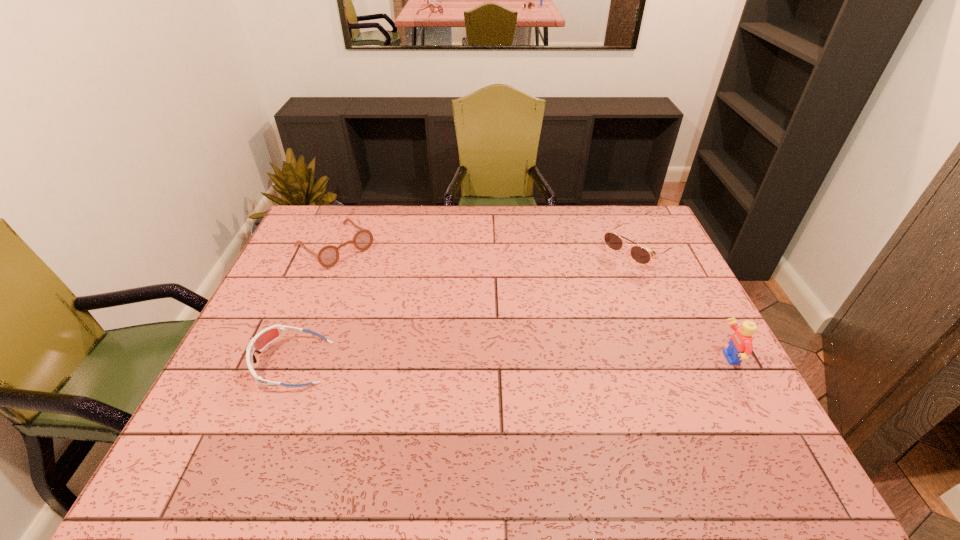
At what (x,y) coordinates should I click in order to perform the action: click on vacant area that lies between the second tallest object and the tallest object. Please return your answer as a coordinate pair (x, y). The height and width of the screenshot is (540, 960). Looking at the image, I should click on (682, 306).

You are a GUI agent. You are given a task and a screenshot of the screen. Output one action in this format:
    pyautogui.click(x=<x>, y=<y>)
    Task: Click on the unoccupied position between the tallest object and the spectacles
    This screenshot has width=960, height=540.
    Given the screenshot: What is the action you would take?
    pyautogui.click(x=531, y=302)

What are the coordinates of `free space that is in between the goggles and the tallest object` in the screenshot? It's located at (510, 361).

Identify the location of vacant point located between the spectacles and the Lego. This screenshot has height=540, width=960. (531, 302).

Find the location of a particular element. This screenshot has height=540, width=960. free space that is in between the spectacles and the tallest object is located at coordinates (531, 302).

Find the location of `vacant area that lies between the spectacles and the goggles`. vacant area that lies between the spectacles and the goggles is located at coordinates (313, 305).

You are a GUI agent. You are given a task and a screenshot of the screen. Output one action in this format:
    pyautogui.click(x=<x>, y=<y>)
    Task: Click on the empty location between the sunglasses and the Lego
    Image resolution: width=960 pixels, height=540 pixels.
    Given the screenshot: What is the action you would take?
    pyautogui.click(x=682, y=306)

You are a GUI agent. You are given a task and a screenshot of the screen. Output one action in this format:
    pyautogui.click(x=<x>, y=<y>)
    Task: Click on the empty space between the tallest object and the spectacles
    The height and width of the screenshot is (540, 960).
    Given the screenshot: What is the action you would take?
    click(531, 302)

You are a GUI agent. You are given a task and a screenshot of the screen. Output one action in this format:
    pyautogui.click(x=<x>, y=<y>)
    Task: Click on the object that stands as the third closest to the goggles
    
    Given the screenshot: What is the action you would take?
    pyautogui.click(x=740, y=346)

Locate which object is the closest to the sunglasses. Please provide its 2D coordinates. Your answer should be formatted as a tuple, i.e. [(x, y)], where the tuple contains the x and y coordinates of a point satisfying the conditions above.

[(740, 346)]